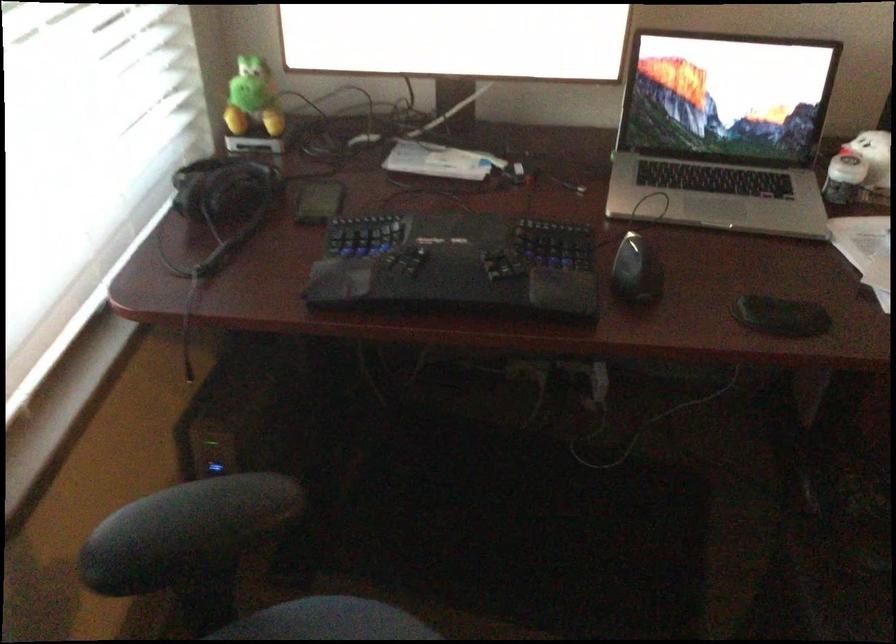
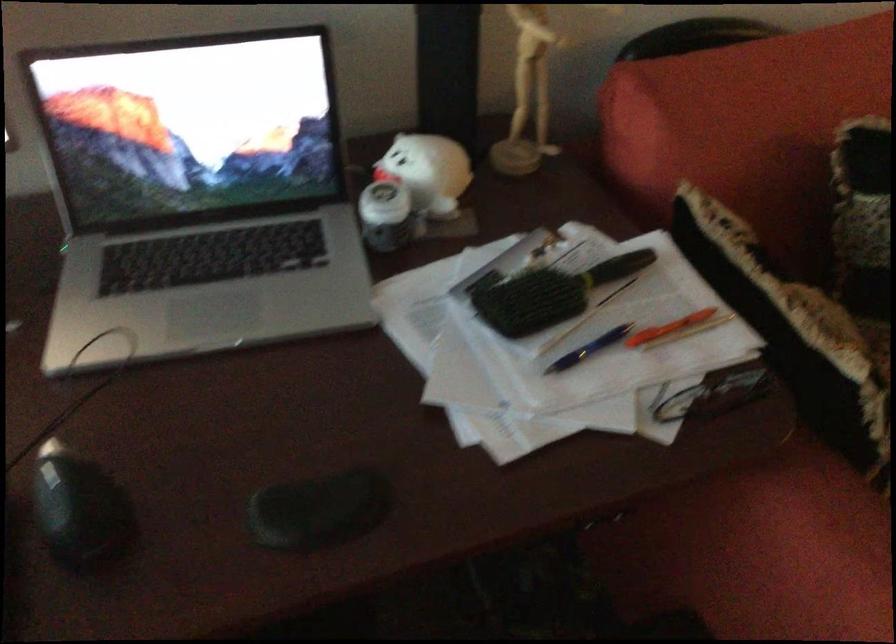
In a continuous first-person perspective shot, in which direction is the camera moving?

The movement direction of the cameraman is right, forward.